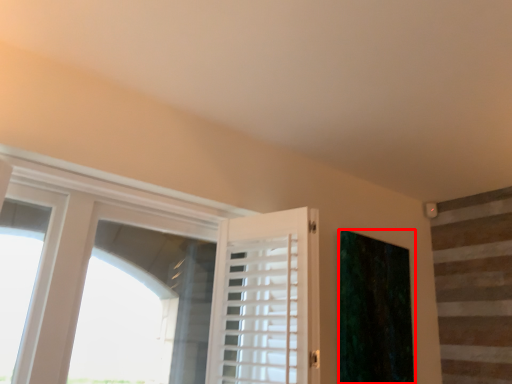
Question: In this image, where is curtain (annotated by the red box) located relative to barn door?

Choices:
 (A) left
 (B) right

Answer: (B)